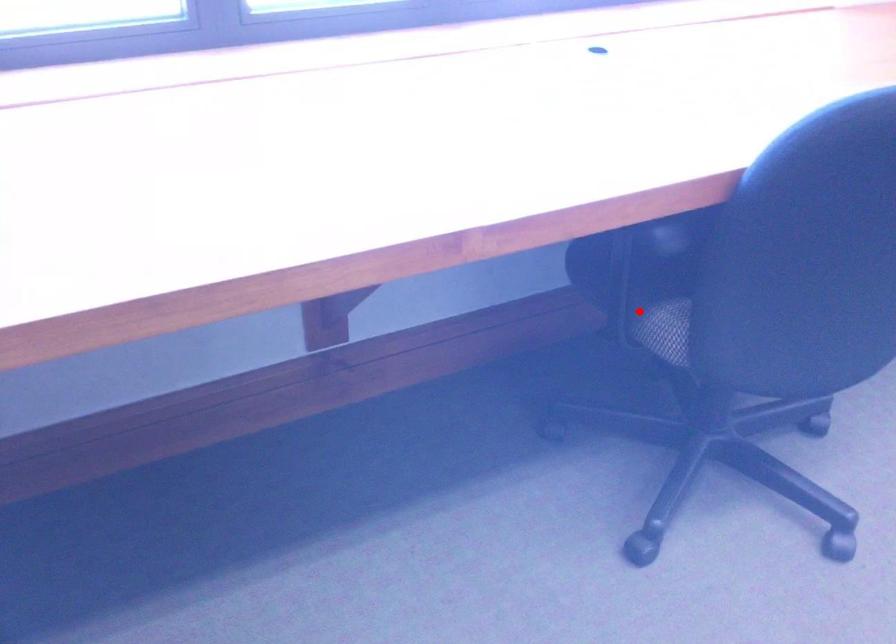
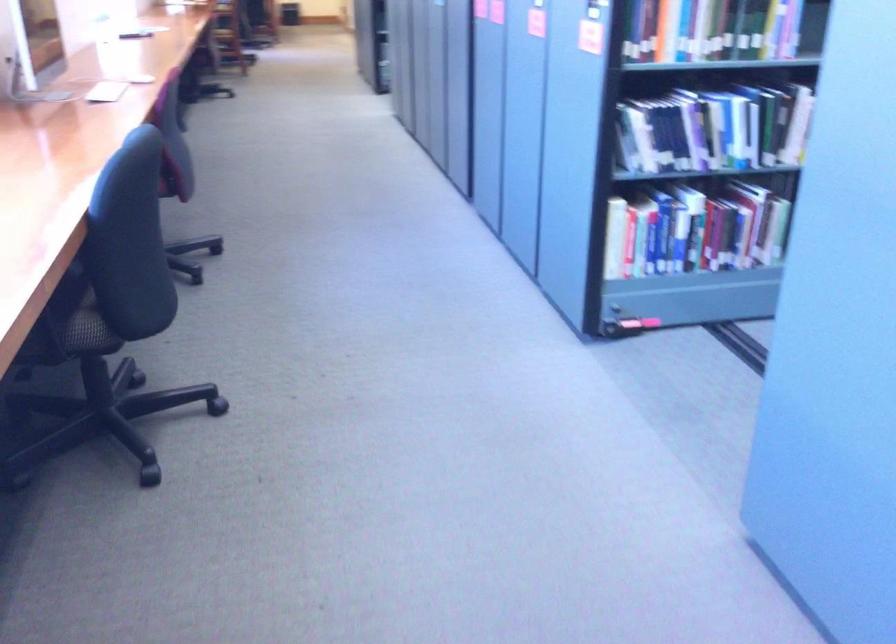
Question: I am providing you with two images of the same scene from different viewpoints. Given a red point in image1, look at the same physical point in image2. Is it:

Choices:
 (A) Closer to the viewpoint
 (B) Farther from the viewpoint

Answer: (B)